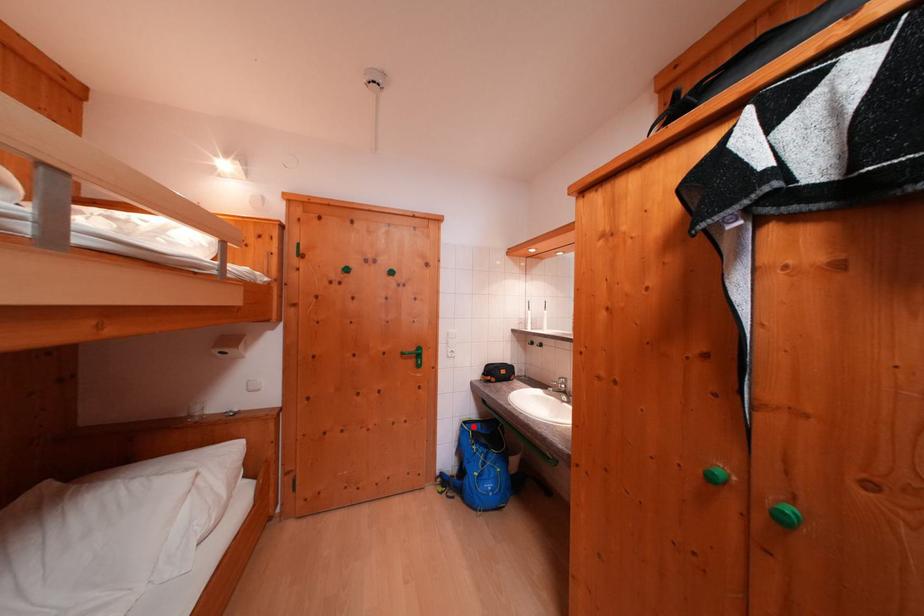
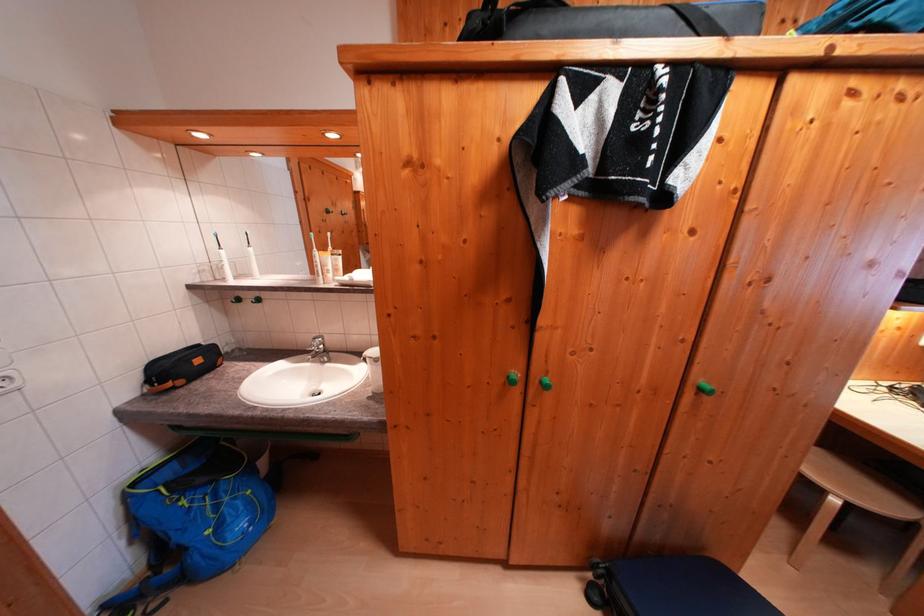
The point at the highlighted location is marked in the first image. Where is the corresponding point in the second image?

(142, 488)